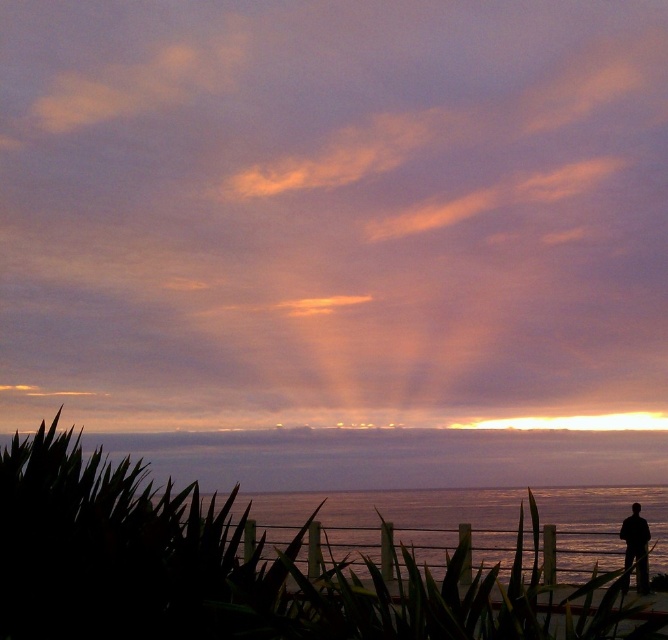
You are a photographer trying to capture the sunset scene. You notice the silvery water at lower right and the silhouette figure at lower right. Which object is bigger in the image?

The silvery water at lower right is larger in size compared to the silhouette figure at lower right.

You are an artist trying to paint the sunset scene. You have to decide the size of the silhouette figure at lower right relative to the purple matte cloud at upper center. Based on the scene, which one should you make larger in your painting?

The purple matte cloud at upper center should be painted larger than the silhouette figure at lower right because the description states that the purple matte cloud at upper center is bigger than the silhouette figure at lower right.

You are a photographer standing on the beach at sunset. You want to capture a photo where the purple matte cloud at upper center and the silvery water at lower right are both in focus. Given that your camera can only focus on objects within a 10 feet range of each other, will you need to adjust your settings to ensure both are sharp?

The distance between the purple matte cloud at upper center and silvery water at lower right is 13.39 feet, which exceeds the camera focus range of 10 feet. Therefore, you will need to adjust your settings to ensure both are in focus.